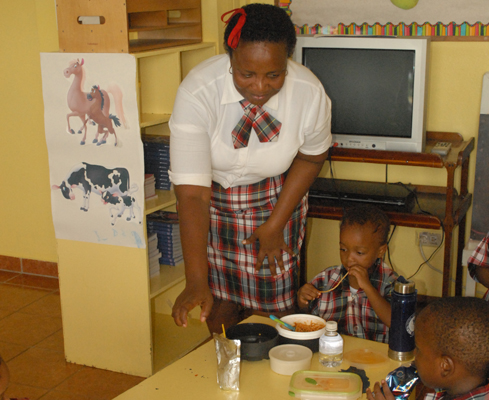
The width and height of the screenshot is (489, 400). Identify the location of bottle of water. [x=334, y=335].